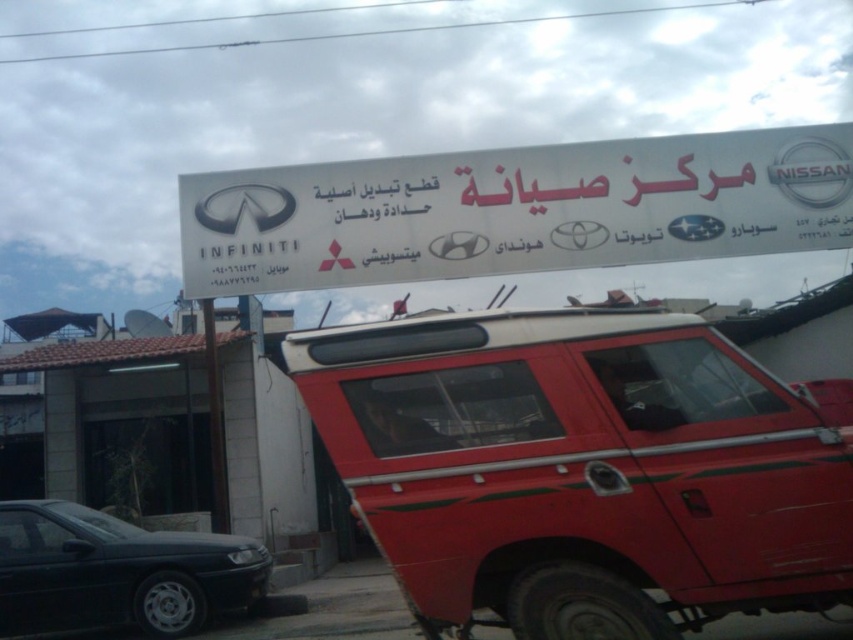
From the picture: Is shiny red jeep at center behind matte black sedan at lower left?

No, it is in front of matte black sedan at lower left.

Does shiny red jeep at center have a greater height compared to matte black sedan at lower left?

Yes.

Describe the element at coordinates (583, 468) in the screenshot. The height and width of the screenshot is (640, 853). I see `shiny red jeep at center` at that location.

Locate an element on the screen. shiny red jeep at center is located at coordinates click(583, 468).

Does point (305, 248) come behind point (50, 561)?

Yes, it is behind point (50, 561).

Measure the distance from white plastic sign at center to matte black sedan at lower left.

The distance of white plastic sign at center from matte black sedan at lower left is 3.95 meters.

Is point (492, 211) positioned before point (184, 540)?

That is False.

Identify the location of white plastic sign at center. (515, 211).

Can you confirm if shiny red jeep at center is thinner than white plastic sign at center?

Correct, shiny red jeep at center's width is less than white plastic sign at center's.

Is shiny red jeep at center shorter than white plastic sign at center?

Indeed, shiny red jeep at center has a lesser height compared to white plastic sign at center.

Locate an element on the screen. The width and height of the screenshot is (853, 640). shiny red jeep at center is located at coordinates (583, 468).

Where is `shiny red jeep at center`? shiny red jeep at center is located at coordinates (583, 468).